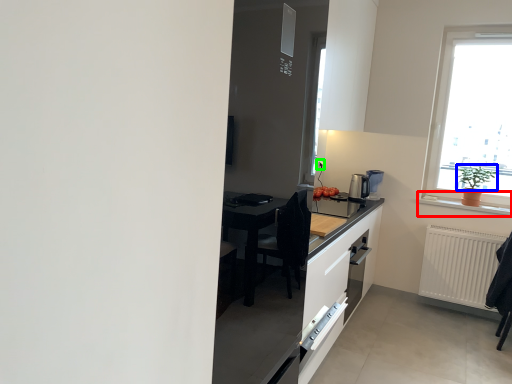
Question: Which is farther away from window sill (highlighted by a red box)? plant (highlighted by a blue box) or electric outlet (highlighted by a green box)?

Choices:
 (A) plant
 (B) electric outlet

Answer: (B)